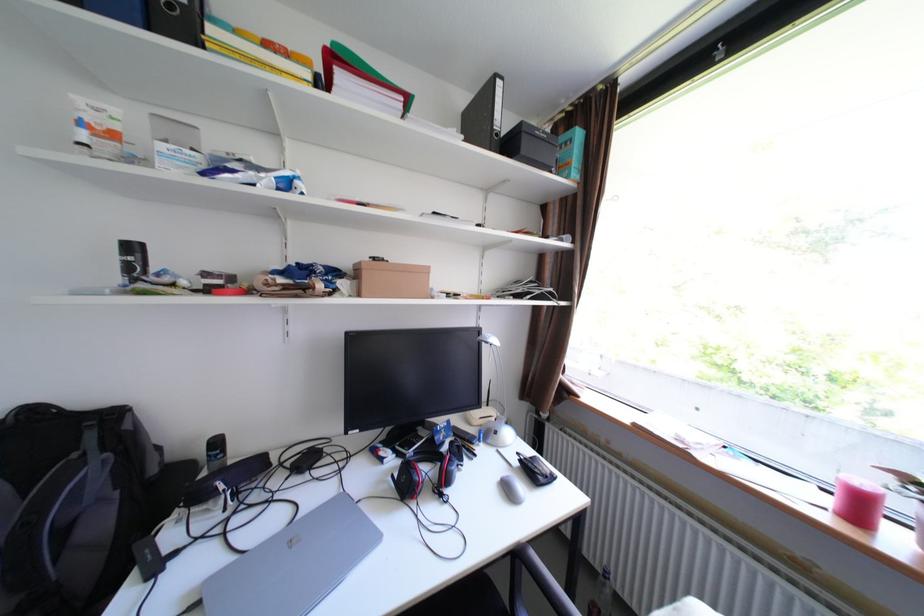
What do you see at coordinates (565, 581) in the screenshot? I see `the chair sitting surface` at bounding box center [565, 581].